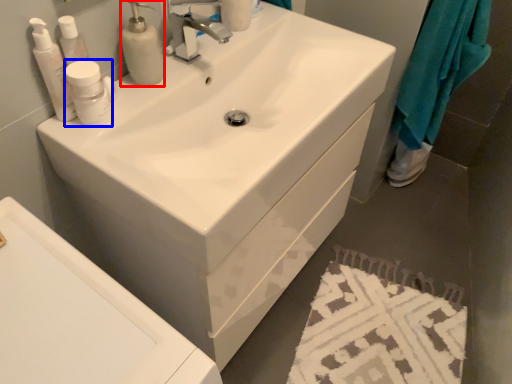
Question: Which point is closer to the camera, soap dispenser (highlighted by a red box) or mouthwash (highlighted by a blue box)?

Choices:
 (A) soap dispenser
 (B) mouthwash

Answer: (B)